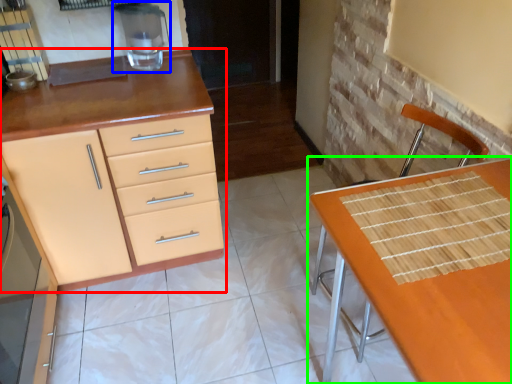
Question: Which object is the closest to the cabinetry (highlighted by a red box)? Choose among these: appliance (highlighted by a blue box) or table (highlighted by a green box).

Choices:
 (A) appliance
 (B) table

Answer: (A)